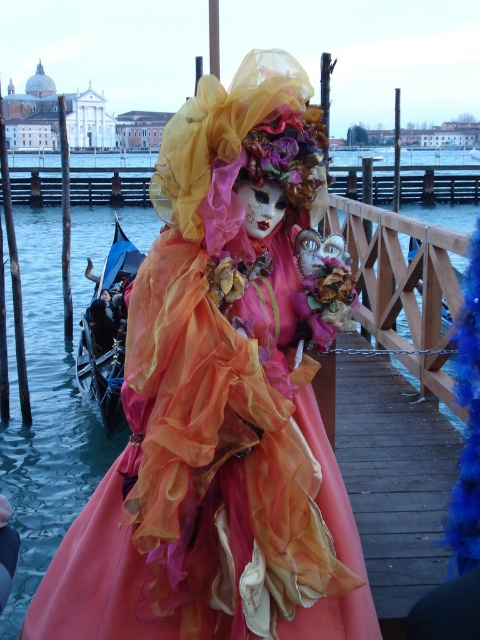
You are standing on the canal bank and see the matte orange fabric doll at center and the black wood boat at left. Which object is nearer to you?

The matte orange fabric doll at center is closer to the viewer than the black wood boat at left, so the matte orange fabric doll at center is nearer to you.

You are a tourist in Venice and want to take a photo with the matte orange fabric doll at center and the black wood boat at left. Which object is smaller in size?

The matte orange fabric doll at center is smaller than the black wood boat at left.